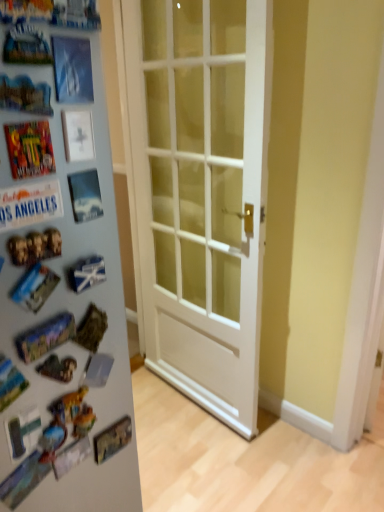
Find the location of a particular element. This screenshot has height=512, width=384. spots to the right of white glossy door at center is located at coordinates (271, 462).